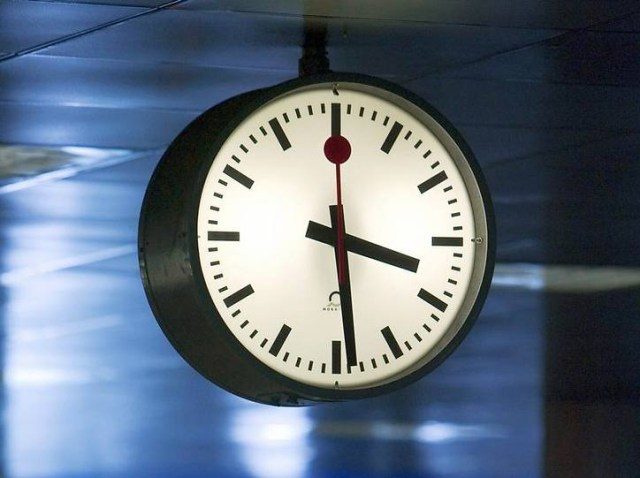
At what (x,y) coordinates should I click in order to perform the action: click on right side of clock. Please return your answer as a coordinate pair (x, y). Looking at the image, I should click on (176, 319).